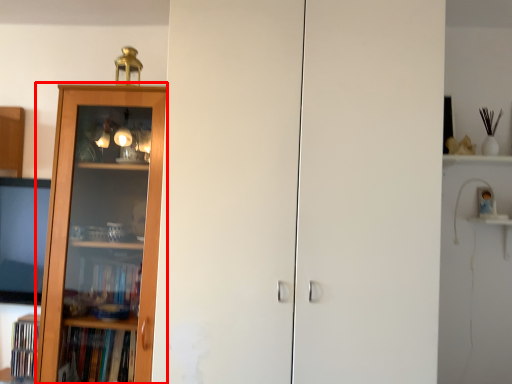
Question: In this image, where is bookcase (annotated by the red box) located relative to screen door?

Choices:
 (A) right
 (B) left

Answer: (B)